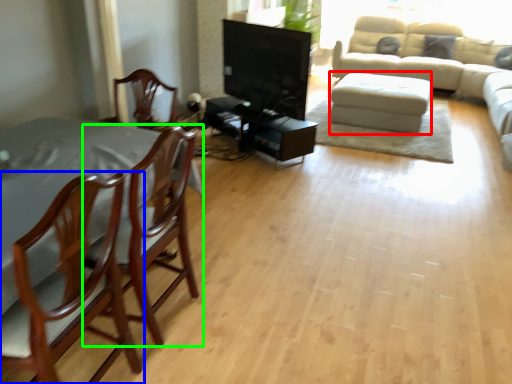
Question: Estimate the real-world distances between objects in this image. Which object is farther from footrest (highlighted by a red box), chair (highlighted by a blue box) or chair (highlighted by a green box)?

Choices:
 (A) chair
 (B) chair

Answer: (A)